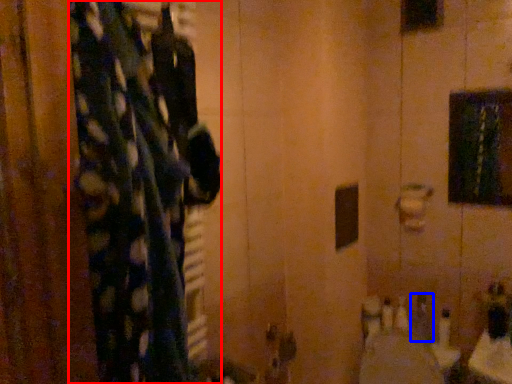
Question: Among these objects, which one is nearest to the camera, curtain (highlighted by a red box) or toiletry (highlighted by a blue box)?

Choices:
 (A) curtain
 (B) toiletry

Answer: (A)